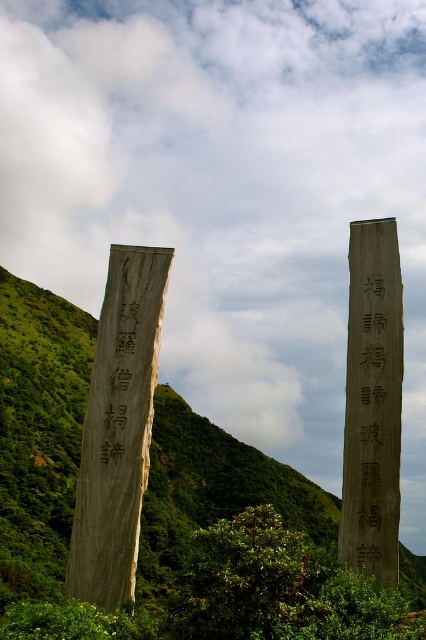
Based on the photo, you are a surveyor tasked with measuring the coordinates of landmarks in the image. You have a point labeled as point 1 at coordinate (373,403). Which object in the scene does this point correspond to?

The point labeled as point 1 at coordinate (373,403) corresponds to the smooth gray stone monument at right.